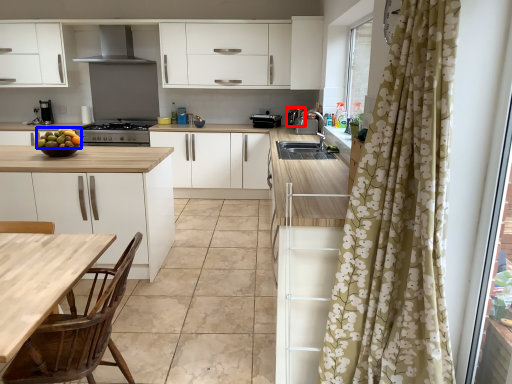
Question: Which object appears closest to the camera in this image, appliance (highlighted by a red box) or fruit (highlighted by a blue box)?

Choices:
 (A) appliance
 (B) fruit

Answer: (B)